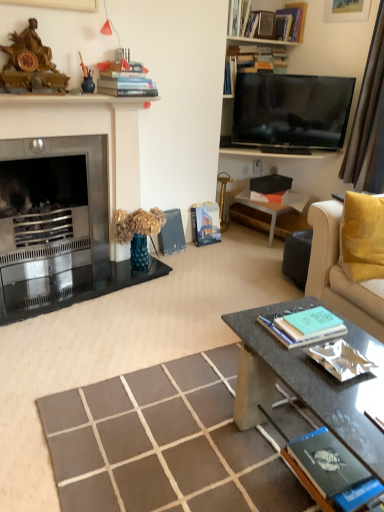
Locate an element on the screen. This screenshot has height=512, width=384. free point above dark gray concrete coffee table at lower right (from a real-world perspective) is located at coordinates (330, 375).